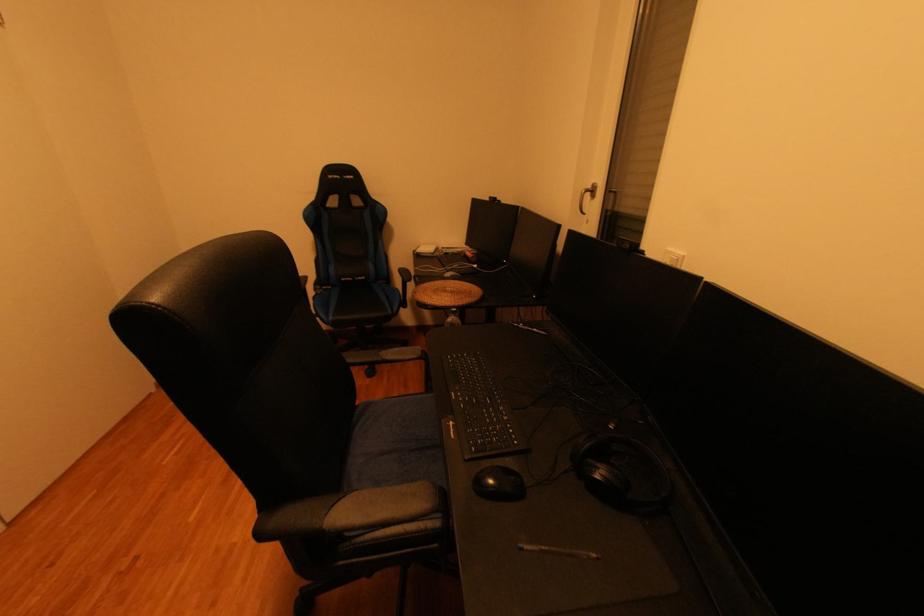
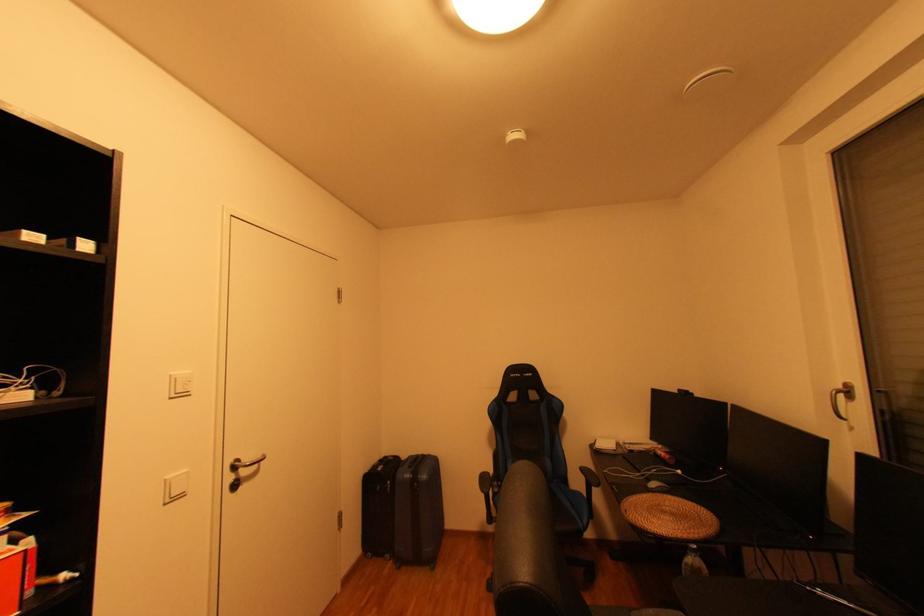
How did the camera likely rotate?

The rotation direction of the camera is left-up.